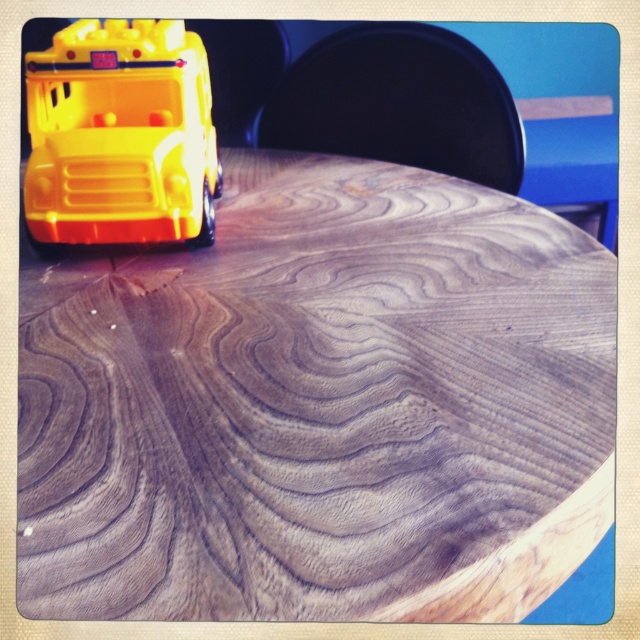
Does wooden table at upper left appear on the left side of yellow plastic toy bus at upper left?

Incorrect, wooden table at upper left is not on the left side of yellow plastic toy bus at upper left.

Describe the element at coordinates (317, 406) in the screenshot. I see `wooden table at upper left` at that location.

Between point (536, 449) and point (129, 106), which one is positioned behind?

The point (129, 106) is more distant.

Locate an element on the screen. The width and height of the screenshot is (640, 640). wooden table at upper left is located at coordinates (317, 406).